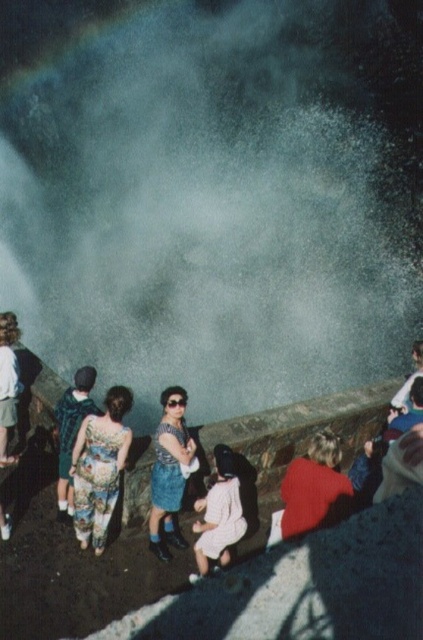
Based on the photo, you are a photographer trying to capture the waterfall scene. You want to position your tripod so that the white mist at center is in the center of your photo. Where should you place the tripod?

You should place the tripod at point (x=214, y=192) to center the white mist at center in your photo.

You are a photographer trying to capture a clear shot of the floral fabric dress at lower left without the white mist at center obstructing the view. Based on their positions, is this possible?

The white mist at center is much taller than the floral fabric dress at lower left, so the mist may block the view of the dress unless you lower your camera angle.

You are standing at the point labeled point (214, 192) in the image. What is the nearest object to you?

The nearest object to you at point (214, 192) is the white mist at center.